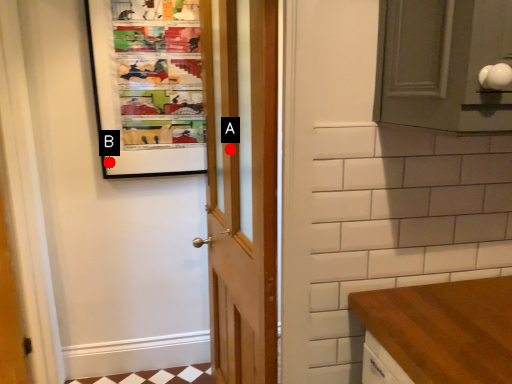
Question: Two points are circled on the image, labeled by A and B beside each circle. Which point appears farthest from the camera in this image?

Choices:
 (A) A is further
 (B) B is further

Answer: (B)